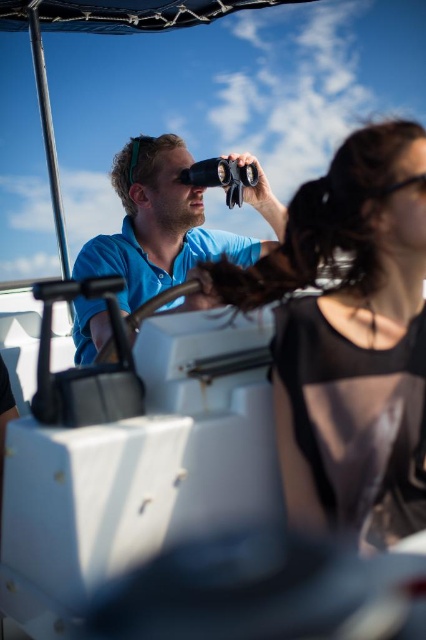
Question: Which point is closer to the camera?

Choices:
 (A) (285, 474)
 (B) (423, 179)

Answer: (A)

Question: Considering the real-world distances, which object is farthest from the black rubber goggles at upper right?

Choices:
 (A) black sheer top at upper right
 (B) matte blue shirt at center

Answer: (B)

Question: Does black sheer top at upper right have a lesser width compared to black rubber goggles at upper right?

Choices:
 (A) yes
 (B) no

Answer: (B)

Question: Does black sheer top at upper right lie behind black rubber goggles at upper right?

Choices:
 (A) yes
 (B) no

Answer: (B)

Question: Observing the image, what is the correct spatial positioning of matte blue shirt at center in reference to black rubber goggles at upper right?

Choices:
 (A) below
 (B) above

Answer: (B)

Question: Which of the following is the closest to the observer?

Choices:
 (A) black rubber goggles at upper right
 (B) matte blue shirt at center
 (C) black sheer top at upper right

Answer: (C)